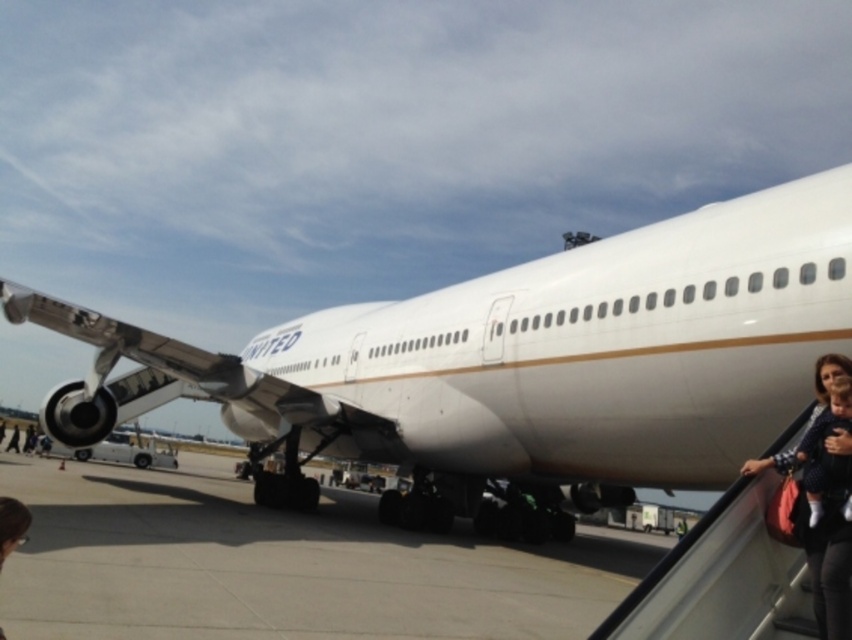
From the picture: Is white glossy airplane at center to the left of dark brown hair at lower left from the viewer's perspective?

Correct, you'll find white glossy airplane at center to the left of dark brown hair at lower left.

Who is positioned more to the left, white glossy airplane at center or dark brown hair at lower left?

From the viewer's perspective, white glossy airplane at center appears more on the left side.

Between point (399, 344) and point (27, 509), which one is positioned behind?

The point (399, 344) is behind.

Locate an element on the screen. This screenshot has height=640, width=852. white glossy airplane at center is located at coordinates (522, 356).

Between point (568, 572) and point (818, 358), which one is positioned behind?

Point (568, 572)

Which is below, gray concrete tarmac at center or matte black dress at lower right?

gray concrete tarmac at center

Where is `gray concrete tarmac at center`? This screenshot has height=640, width=852. gray concrete tarmac at center is located at coordinates (281, 564).

Between matte black dress at lower right and dark brown hair at lower left, which one is positioned higher?

Positioned higher is matte black dress at lower right.

Does matte black dress at lower right have a lesser width compared to dark brown hair at lower left?

In fact, matte black dress at lower right might be wider than dark brown hair at lower left.

Which is in front, point (825, 634) or point (30, 518)?

Point (825, 634) is more forward.

Where is `matte black dress at lower right`? The image size is (852, 640). matte black dress at lower right is located at coordinates (821, 497).